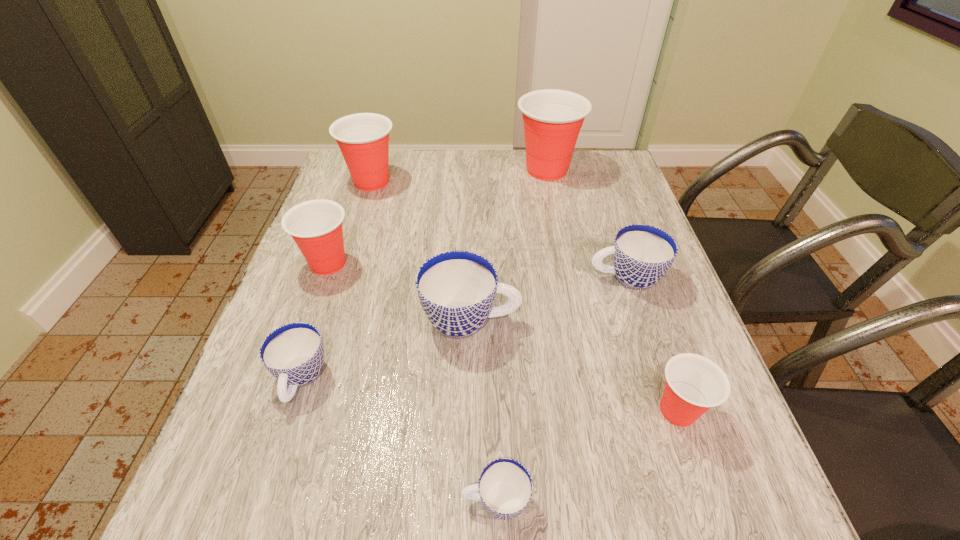
The height and width of the screenshot is (540, 960). I want to click on free space that satisfies the following two spatial constraints: 1. on the side of the third smallest blue cup with the handle; 2. on the side of the seventh tallest cup with the handle, so click(660, 379).

This screenshot has height=540, width=960. I want to click on free region that satisfies the following two spatial constraints: 1. on the side of the biggest blue cup with the handle; 2. on the side of the second smallest blue cup with the handle, so click(x=469, y=379).